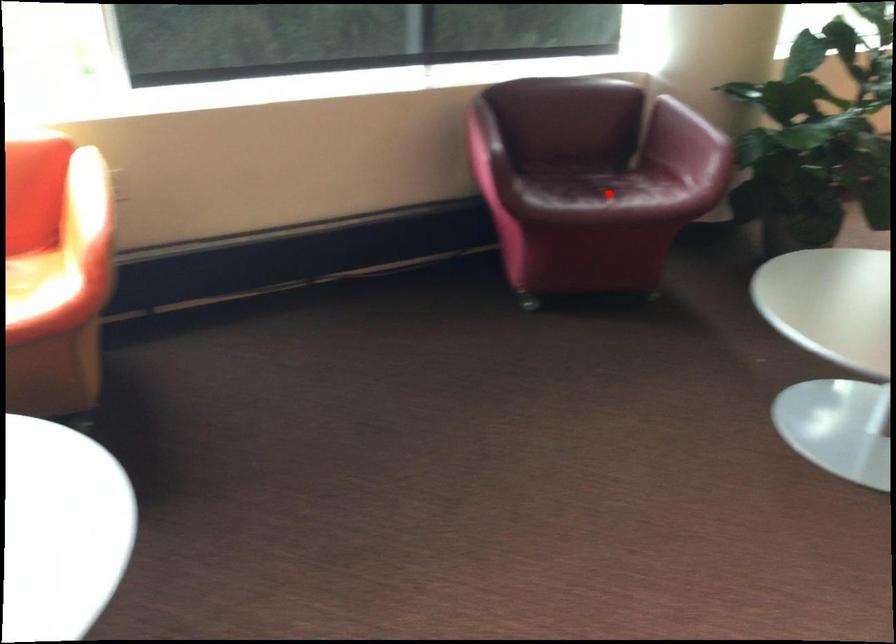
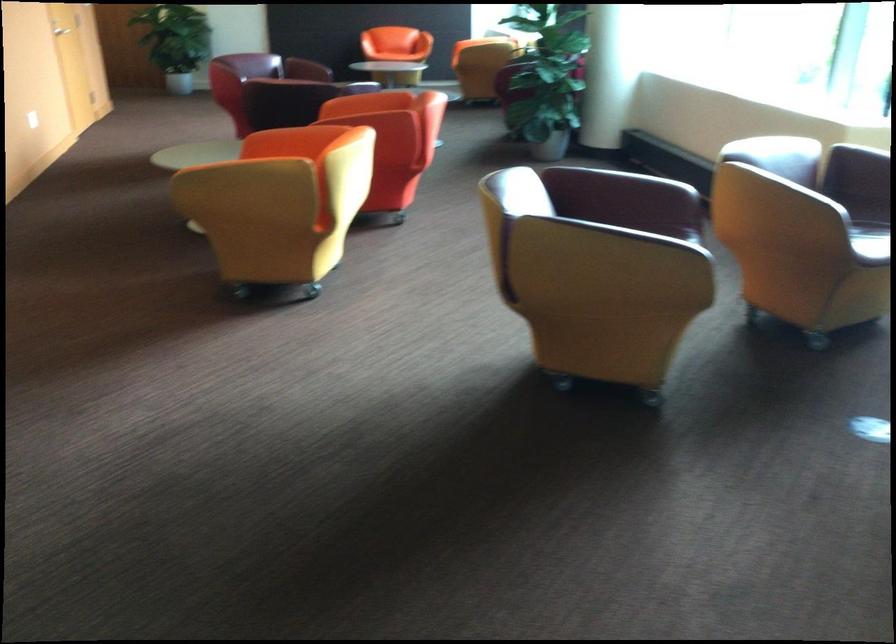
Question: I am providing you with two images of the same scene from different viewpoints. A red point is marked on the first image. Can you still see the location of the red point in image 2?

Choices:
 (A) Yes
 (B) No

Answer: (B)